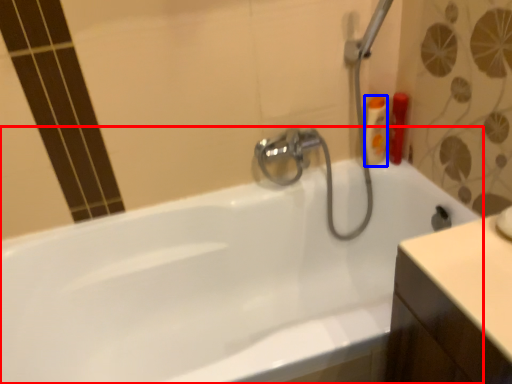
Question: Which point is closer to the camera, bathtub (highlighted by a red box) or toiletry (highlighted by a blue box)?

Choices:
 (A) bathtub
 (B) toiletry

Answer: (A)